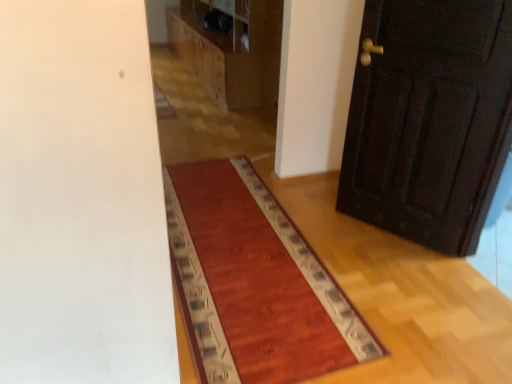
The height and width of the screenshot is (384, 512). What do you see at coordinates (429, 120) in the screenshot? I see `dark wood door at right` at bounding box center [429, 120].

Where is `wooden dresser at upper center`? wooden dresser at upper center is located at coordinates (231, 48).

Where is `dark wood door at right`? dark wood door at right is located at coordinates (429, 120).

Is wooden dresser at upper center directly adjacent to dark wood door at right?

They are not placed beside each other.

Locate an element on the screen. dresser that is under the dark wood door at right (from a real-world perspective) is located at coordinates (231, 48).

How many degrees apart are the facing directions of wooden dresser at upper center and dark wood door at right?

The angle between the facing direction of wooden dresser at upper center and the facing direction of dark wood door at right is 33 degrees.

Considering the positions of objects wooden dresser at upper center and dark wood door at right in the image provided, who is more to the right, wooden dresser at upper center or dark wood door at right?

dark wood door at right is more to the right.

Is dark wood door at right located outside wooden dresser at upper center?

Yes, dark wood door at right is not within wooden dresser at upper center.

From the image's perspective, which is above, dark wood door at right or wooden dresser at upper center?

From the image's view, wooden dresser at upper center is above.

Consider the image. Can you confirm if dark wood door at right is positioned to the right of wooden dresser at upper center?

Indeed, dark wood door at right is positioned on the right side of wooden dresser at upper center.

Does rug with patterned border at center appear on the right side of dark wood door at right?

No, rug with patterned border at center is not to the right of dark wood door at right.

Does point (223, 233) come in front of point (475, 107)?

No, (223, 233) is behind (475, 107).

Considering the relative sizes of rug with patterned border at center and dark wood door at right in the image provided, is rug with patterned border at center taller than dark wood door at right?

No.

From the image's perspective, is rug with patterned border at center on dark wood door at right?

Incorrect, from the image's perspective, rug with patterned border at center is lower than dark wood door at right.

Is dark wood door at right touching rug with patterned border at center?

No, dark wood door at right is not in contact with rug with patterned border at center.

Which is closer to the camera, (440, 238) or (297, 350)?

Point (440, 238) appears to be farther away from the viewer than point (297, 350).

From the image's perspective, which one is positioned higher, dark wood door at right or rug with patterned border at center?

dark wood door at right.

From the image's perspective, which is below, wooden dresser at upper center or rug with patterned border at center?

rug with patterned border at center appears lower in the image.

Which is in front, point (202, 52) or point (254, 260)?

The point (254, 260) is in front.

Looking at this image, which is in front, wooden dresser at upper center or rug with patterned border at center?

Positioned in front is rug with patterned border at center.

Based on the photo, is wooden dresser at upper center smaller than rug with patterned border at center?

No.

Is rug with patterned border at center looking in the opposite direction of wooden dresser at upper center?

No, wooden dresser at upper center is not at the back of rug with patterned border at center.

Looking at this image, can you confirm if rug with patterned border at center is wider than wooden dresser at upper center?

Yes.

From a real-world perspective, which is physically above, rug with patterned border at center or wooden dresser at upper center?

wooden dresser at upper center is physically above.

Identify the location of door in front of the wooden dresser at upper center. (429, 120).

The height and width of the screenshot is (384, 512). In order to click on dresser above the dark wood door at right (from the image's perspective) in this screenshot , I will do `click(231, 48)`.

Estimate the real-world distances between objects in this image. Which object is further from wooden dresser at upper center, dark wood door at right or rug with patterned border at center?

rug with patterned border at center is positioned further to the anchor wooden dresser at upper center.

When comparing their distances from wooden dresser at upper center, does rug with patterned border at center or dark wood door at right seem closer?

Based on the image, dark wood door at right appears to be nearer to wooden dresser at upper center.

When comparing their distances from rug with patterned border at center, does dark wood door at right or wooden dresser at upper center seem further?

The object further to rug with patterned border at center is wooden dresser at upper center.

Considering their positions, is rug with patterned border at center positioned further to dark wood door at right than wooden dresser at upper center?

Among the two, wooden dresser at upper center is located further to dark wood door at right.

Consider the image. From the image, which object appears to be nearer to rug with patterned border at center, wooden dresser at upper center or dark wood door at right?

Based on the image, dark wood door at right appears to be nearer to rug with patterned border at center.

Based on their spatial positions, is wooden dresser at upper center or rug with patterned border at center further from dark wood door at right?

wooden dresser at upper center.

Image resolution: width=512 pixels, height=384 pixels. Find the location of `door positioned between rug with patterned border at center and wooden dresser at upper center from near to far`. door positioned between rug with patterned border at center and wooden dresser at upper center from near to far is located at coordinates (429, 120).